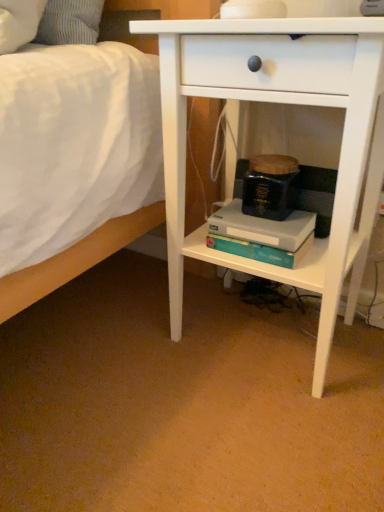
Locate an element on the screen. The image size is (384, 512). free space in front of white matte nightstand at center is located at coordinates (245, 438).